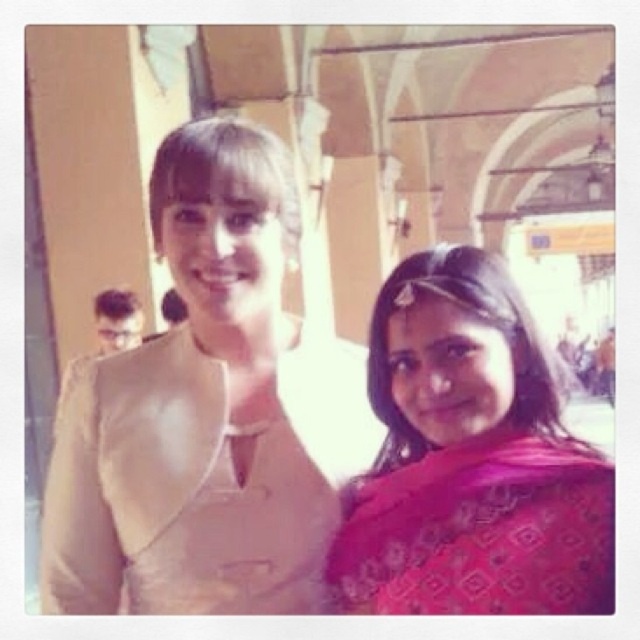
Can you confirm if beige fabric at center is wider than silky pink sari at right?

Yes, beige fabric at center is wider than silky pink sari at right.

Locate an element on the screen. This screenshot has height=640, width=640. beige fabric at center is located at coordinates (205, 413).

Is point (328, 544) closer to camera compared to point (464, 577)?

That is False.

Locate an element on the screen. beige fabric at center is located at coordinates (205, 413).

Is point (257, 236) farther from camera compared to point (362, 545)?

Yes.

This screenshot has height=640, width=640. Identify the location of beige fabric at center. (205, 413).

Locate an element on the screen. Image resolution: width=640 pixels, height=640 pixels. beige fabric at center is located at coordinates (205, 413).

This screenshot has width=640, height=640. What do you see at coordinates (472, 458) in the screenshot? I see `pink printed saree at right` at bounding box center [472, 458].

The image size is (640, 640). In order to click on pink printed saree at right in this screenshot , I will do pyautogui.click(x=472, y=458).

The height and width of the screenshot is (640, 640). What do you see at coordinates (472, 458) in the screenshot? I see `pink printed saree at right` at bounding box center [472, 458].

I want to click on pink printed saree at right, so click(x=472, y=458).